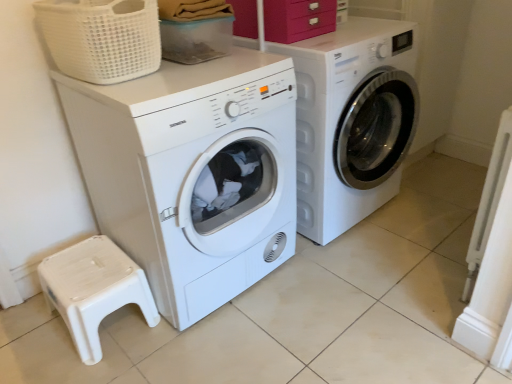
Where is `vacant area that is in front of translucent plastic container at upper center`? The width and height of the screenshot is (512, 384). vacant area that is in front of translucent plastic container at upper center is located at coordinates (208, 76).